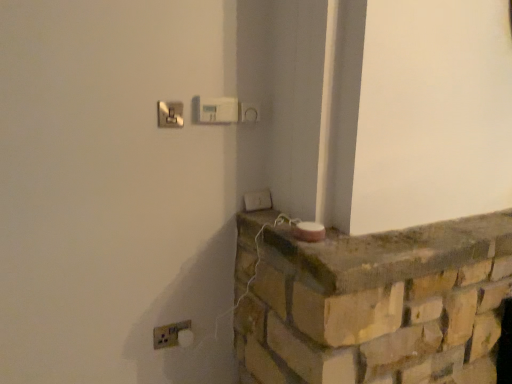
Question: Should I look upward or downward to see rustic stone ledge at center?

Choices:
 (A) down
 (B) up

Answer: (A)

Question: Can you confirm if white plastic light switch at lower center, acting as the 3th light switch starting from the left, is positioned to the right of white plastic electric outlet at lower left?

Choices:
 (A) no
 (B) yes

Answer: (B)

Question: Are white plastic light switch at lower center, acting as the 1th light switch starting from the back, and white plastic electric outlet at lower left located far from each other?

Choices:
 (A) yes
 (B) no

Answer: (B)

Question: Considering the relative sizes of white plastic light switch at lower center, positioned as the first light switch in right-to-left order, and white plastic electric outlet at lower left in the image provided, is white plastic light switch at lower center, positioned as the first light switch in right-to-left order, wider than white plastic electric outlet at lower left?

Choices:
 (A) yes
 (B) no

Answer: (A)

Question: From a real-world perspective, is white plastic light switch at lower center, the 1th light switch positioned from the bottom, on white plastic electric outlet at lower left?

Choices:
 (A) yes
 (B) no

Answer: (A)

Question: Is white plastic light switch at lower center, marked as the 3th light switch in a top-to-bottom arrangement, oriented away from white plastic electric outlet at lower left?

Choices:
 (A) no
 (B) yes

Answer: (A)

Question: Can you confirm if white plastic light switch at lower center, acting as the 3th light switch starting from the left, is bigger than white plastic electric outlet at lower left?

Choices:
 (A) no
 (B) yes

Answer: (B)

Question: Does rustic stone ledge at center have a lesser width compared to matte silver switch at upper center, the 3th light switch viewed from the right?

Choices:
 (A) yes
 (B) no

Answer: (B)

Question: Does rustic stone ledge at center have a smaller size compared to matte silver switch at upper center, the second light switch from the top?

Choices:
 (A) no
 (B) yes

Answer: (A)

Question: From the image's perspective, is rustic stone ledge at center beneath matte silver switch at upper center, the 3th light switch viewed from the right?

Choices:
 (A) yes
 (B) no

Answer: (A)

Question: Is rustic stone ledge at center outside of matte silver switch at upper center, which appears as the 3th light switch when viewed from the back?

Choices:
 (A) yes
 (B) no

Answer: (A)

Question: Is rustic stone ledge at center taller than matte silver switch at upper center, the 1th light switch in the left-to-right sequence?

Choices:
 (A) yes
 (B) no

Answer: (A)

Question: Could you tell me if rustic stone ledge at center is turned towards matte silver switch at upper center, the 1th light switch in the left-to-right sequence?

Choices:
 (A) no
 (B) yes

Answer: (A)

Question: Does matte silver switch at upper center, the 3th light switch viewed from the right, appear on the left side of white plastic light switch at upper center, the second light switch from the left?

Choices:
 (A) no
 (B) yes

Answer: (B)